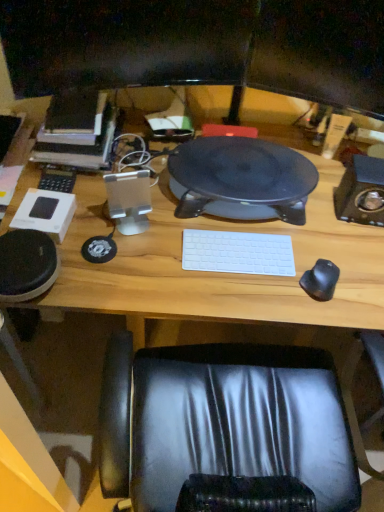
This screenshot has height=512, width=384. I want to click on free space between white matte keyboard at center and black plastic speaker at center, so click(236, 236).